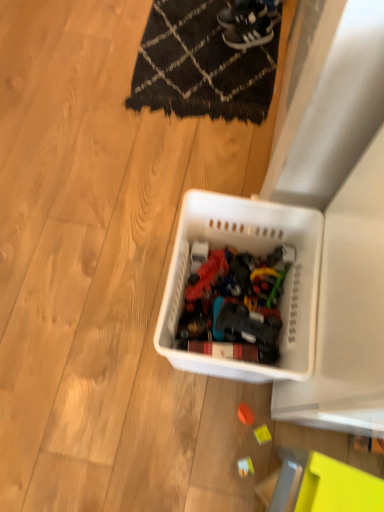
The height and width of the screenshot is (512, 384). I want to click on free space in front of orange matte ball at center, acting as the 3th toy starting from the bottom, so click(x=235, y=466).